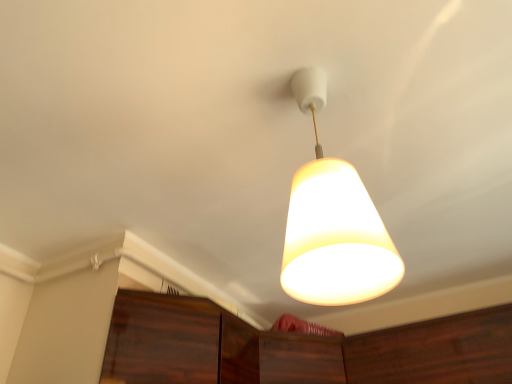
This screenshot has height=384, width=512. I want to click on matte white lampshade at center, so tap(333, 224).

What is the approximate width of matte white lampshade at center?

matte white lampshade at center is 8.56 inches in width.

Describe the element at coordinates (333, 224) in the screenshot. I see `matte white lampshade at center` at that location.

Identify the location of matte white lampshade at center. (333, 224).